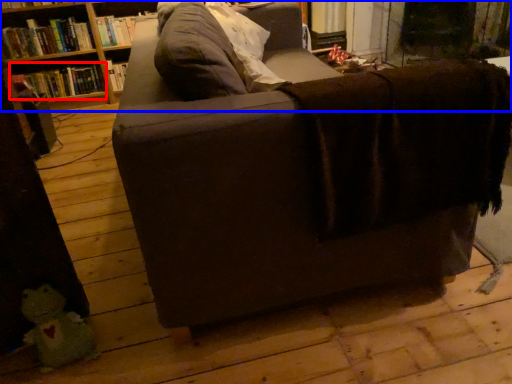
Question: Which of the following is the farthest to the observer, book (highlighted by a red box) or shelf (highlighted by a blue box)?

Choices:
 (A) book
 (B) shelf

Answer: (A)